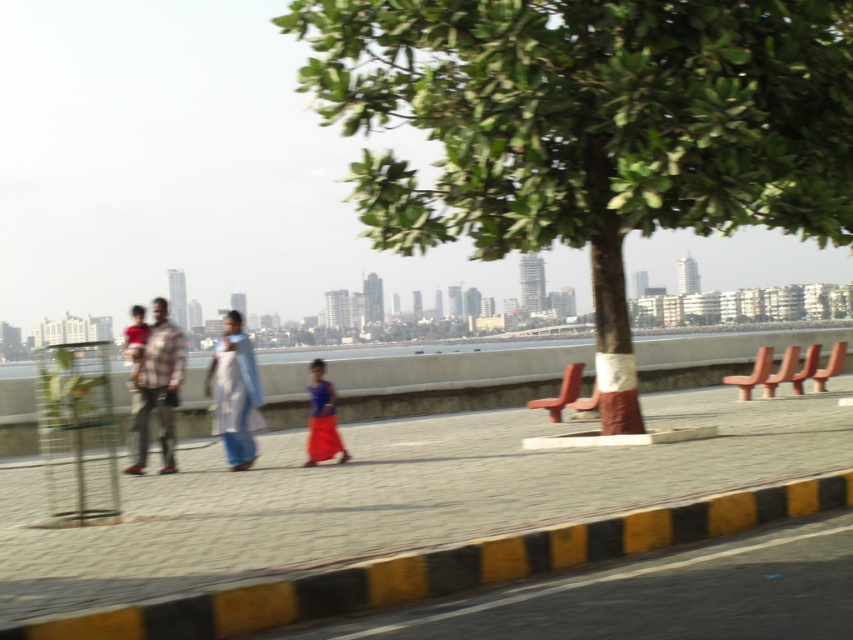
Question: Which object appears closest to the camera in this image?

Choices:
 (A) gray concrete pavement at center
 (B) green leafy tree at center
 (C) plaid fabric shirt at center
 (D) matte red shirt at left

Answer: (A)

Question: Does gray concrete pavement at center lie behind blue fabric dress at center?

Choices:
 (A) yes
 (B) no

Answer: (B)

Question: Can you confirm if plaid fabric shirt at center is positioned to the right of matte red shirt at left?

Choices:
 (A) no
 (B) yes

Answer: (B)

Question: Which object is closer to the camera taking this photo?

Choices:
 (A) green leafy tree at center
 (B) plaid fabric shirt at center

Answer: (B)

Question: From the image, what is the correct spatial relationship of gray concrete pavement at center in relation to plaid fabric shirt at center?

Choices:
 (A) left
 (B) right

Answer: (B)

Question: Among these objects, which one is nearest to the camera?

Choices:
 (A) light blue fabric dress at center
 (B) gray concrete pavement at center
 (C) plaid fabric shirt at center

Answer: (B)